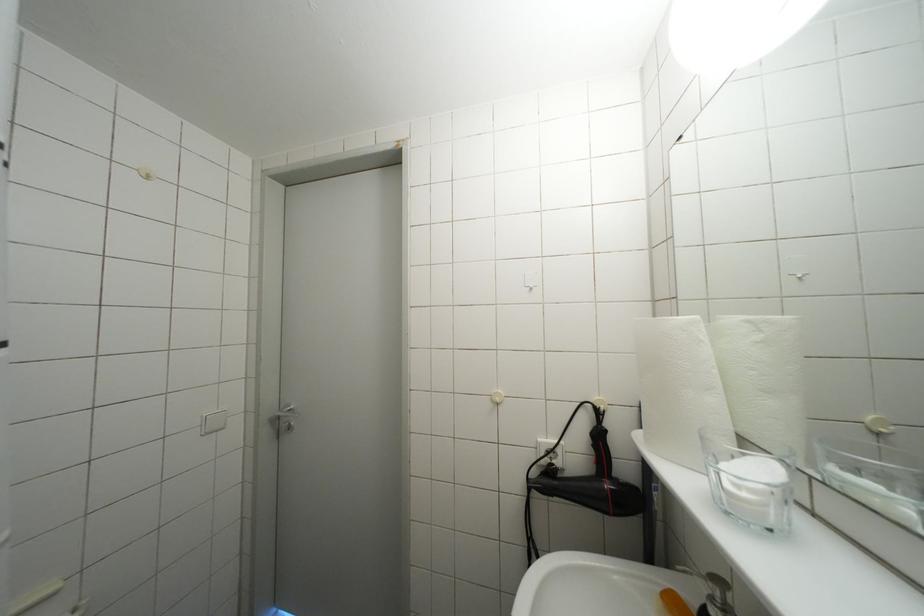
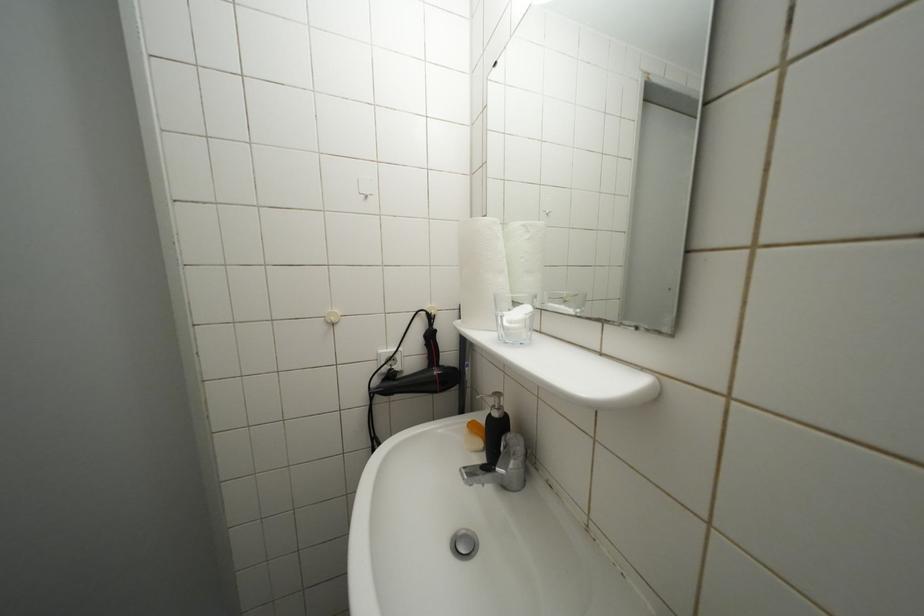
Question: The camera is either moving clockwise (left) or counter-clockwise (right) around the object. The first image is from the beginning of the video and the second image is from the end. Is the camera moving left or right when shooting the video?

Choices:
 (A) Left
 (B) Right

Answer: (A)